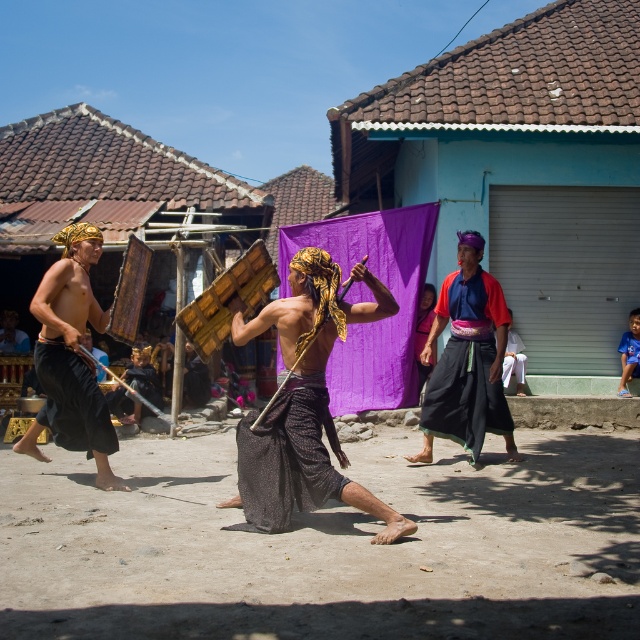
Consider the image. Is purple fabric at center thinner than matte brown wooden staff at center?

Incorrect, purple fabric at center's width is not less than matte brown wooden staff at center's.

Between purple fabric at center and matte brown wooden staff at center, which one appears on the left side from the viewer's perspective?

matte brown wooden staff at center is more to the left.

Between point (538, 93) and point (305, 256), which one is positioned behind?

Positioned behind is point (538, 93).

The height and width of the screenshot is (640, 640). I want to click on purple fabric at center, so click(x=522, y=172).

Between point (337, 284) and point (40, 285), which one is positioned in front?

Point (337, 284) is more forward.

Between matte brown wooden staff at center and matte black shield at left, which one has less height?

With less height is matte brown wooden staff at center.

Between point (369, 499) and point (38, 356), which one is positioned in front?

Point (369, 499) is more forward.

At what (x,y) coordinates should I click in order to perform the action: click on matte brown wooden staff at center. Please return your answer as a coordinate pair (x, y). The width and height of the screenshot is (640, 640). Looking at the image, I should click on (305, 401).

How distant is matte brown wooden staff at center from black textured cloth at center?

matte brown wooden staff at center is 15.40 centimeters away from black textured cloth at center.

Is matte brown wooden staff at center taller than black textured cloth at center?

Indeed, matte brown wooden staff at center has a greater height compared to black textured cloth at center.

Which is in front, point (260, 428) or point (312, 458)?

Point (312, 458)

The height and width of the screenshot is (640, 640). I want to click on matte brown wooden staff at center, so click(x=305, y=401).